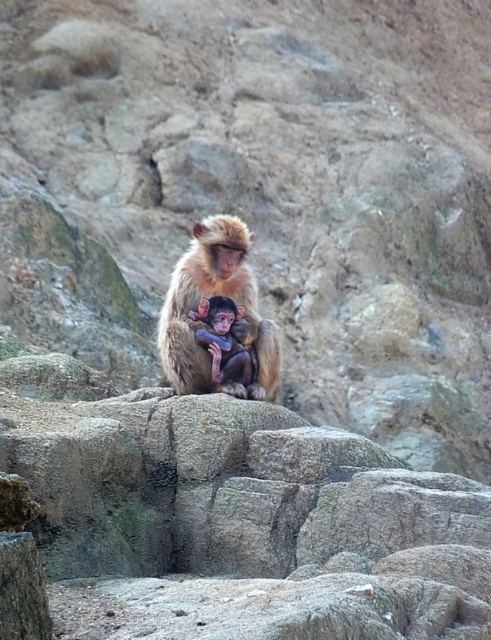
Between furry brown monkey at center and soft brown fur monkey at center, which one appears on the left side from the viewer's perspective?

Positioned to the left is furry brown monkey at center.

Describe the element at coordinates (210, 296) in the screenshot. I see `furry brown monkey at center` at that location.

Which is behind, point (226, 224) or point (208, 352)?

Positioned behind is point (226, 224).

Identify the location of furry brown monkey at center. The width and height of the screenshot is (491, 640). (210, 296).